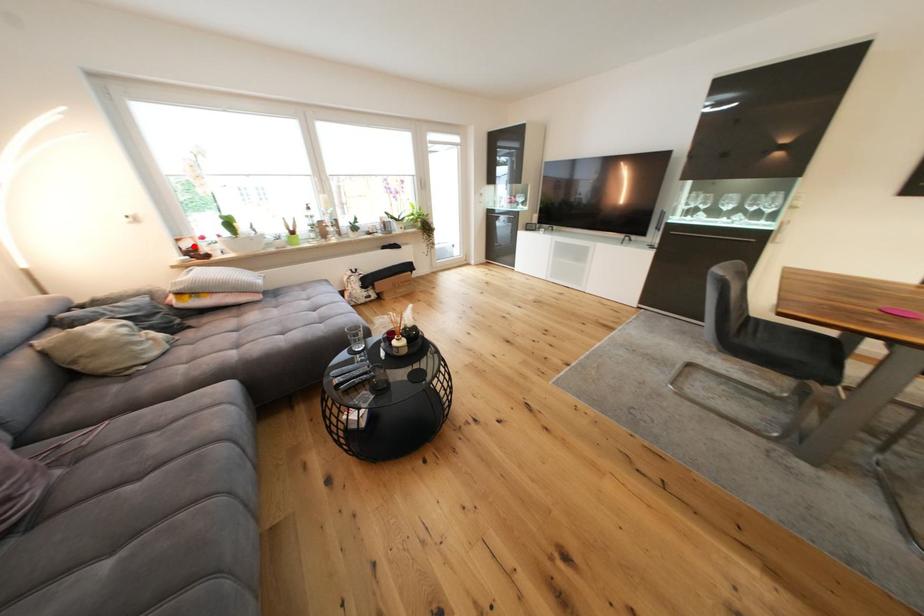
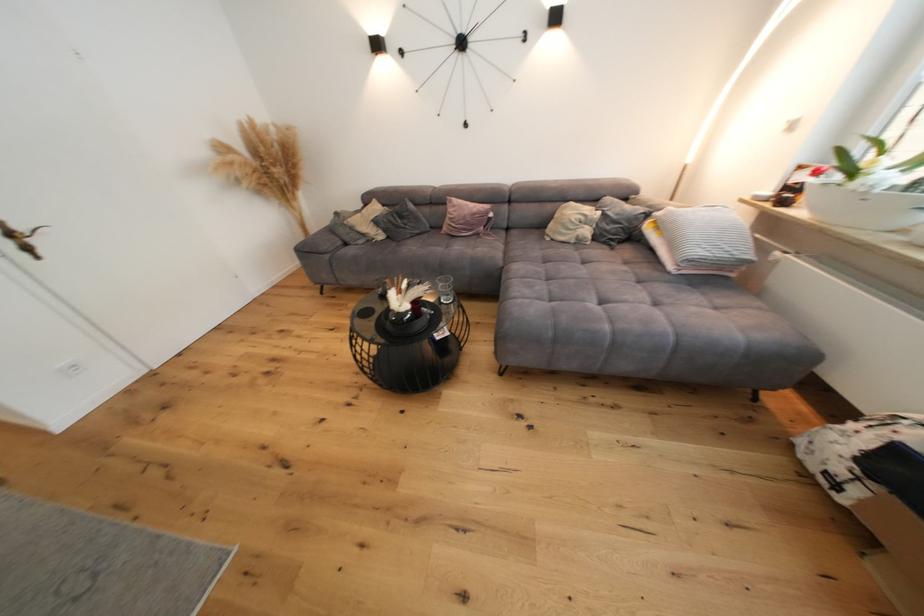
Question: I am providing you with two images of the same scene from different viewpoints. In image1, a red point is highlighted. Considering the same 3D point in image2, which of the following is correct?

Choices:
 (A) It is closer
 (B) It is farther

Answer: (B)